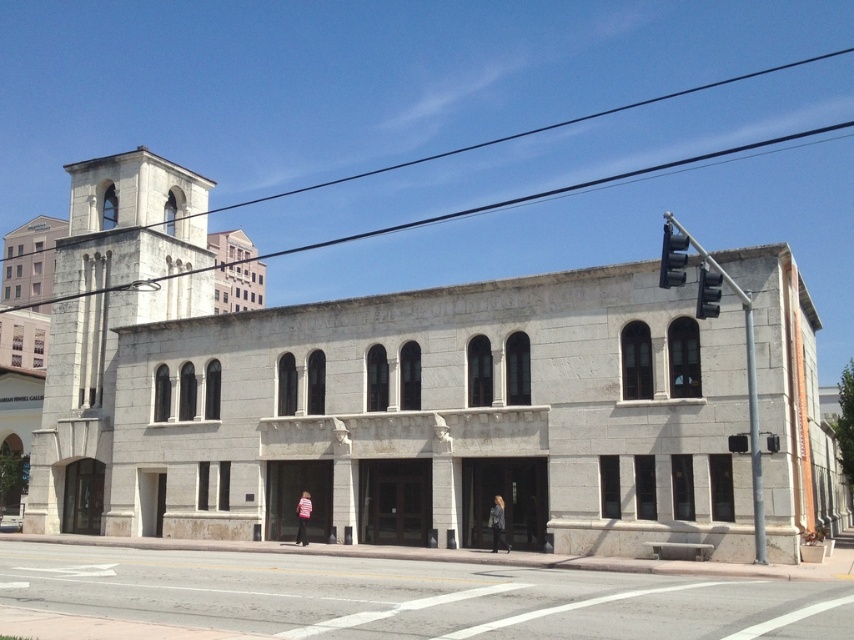
Looking at this image, you are a delivery person needing to park your 2.5 meter wide delivery van. You see the gray concrete road at lower center and the white stone tower at left. Which location has enough space to park the van?

The gray concrete road at lower center is wider than the white stone tower at left, so the gray concrete road at lower center can accommodate the 2.5 meter wide delivery van.

You are a photographer planning to take a wide shot of the gray stone church at center and the gray concrete road at lower center. Based on their sizes, which object should you focus on to ensure both are fully captured in the frame?

The gray stone church at center is wider than the gray concrete road at lower center. To ensure both are fully captured in the frame, focus on the gray stone church at center since it has a larger width and will require more space in the composition.